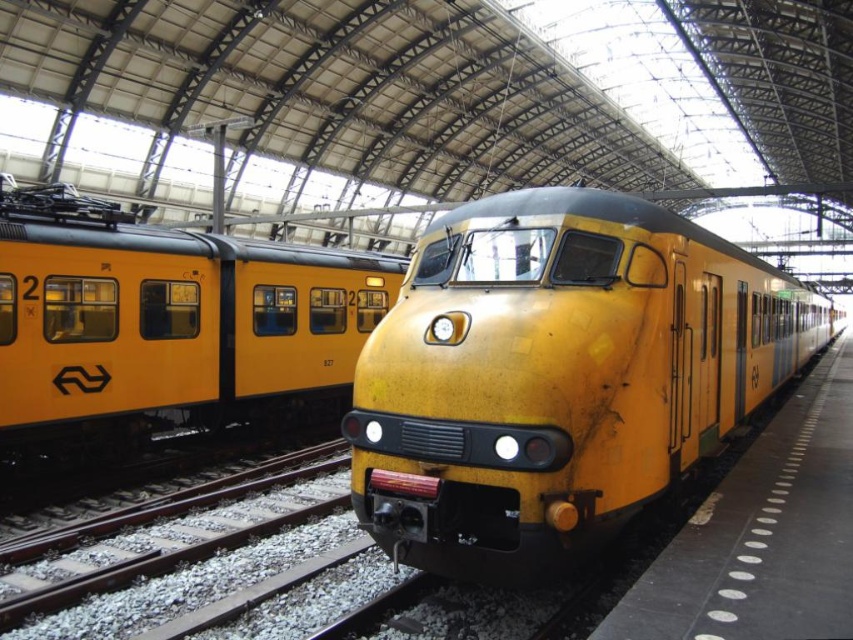
You are standing at the train station and want to board the yellow matte train at center. Based on the coordinates provided, which direction should you walk to reach it?

The yellow matte train at center is located at coordinates point (558, 376), so you should walk towards the center of the platform to reach it.

You are standing at the train station and want to reach a specific point marked at coordinates point (454,436). If your maximum comfortable walking distance is 5 meters, can you comfortably walk to that point?

The distance of point (454,436) from camera is 4.94 meters, so yes, you can comfortably walk to that point since it is within your 5 meter limit.

You are a passenger at the train station and want to board the lower train. Can you tell me which one you should choose between the yellow matte train at center and the matte yellow train at center?

The yellow matte train at center has a lesser height compared to the matte yellow train at center, so you should choose the yellow matte train at center to board the lower one.